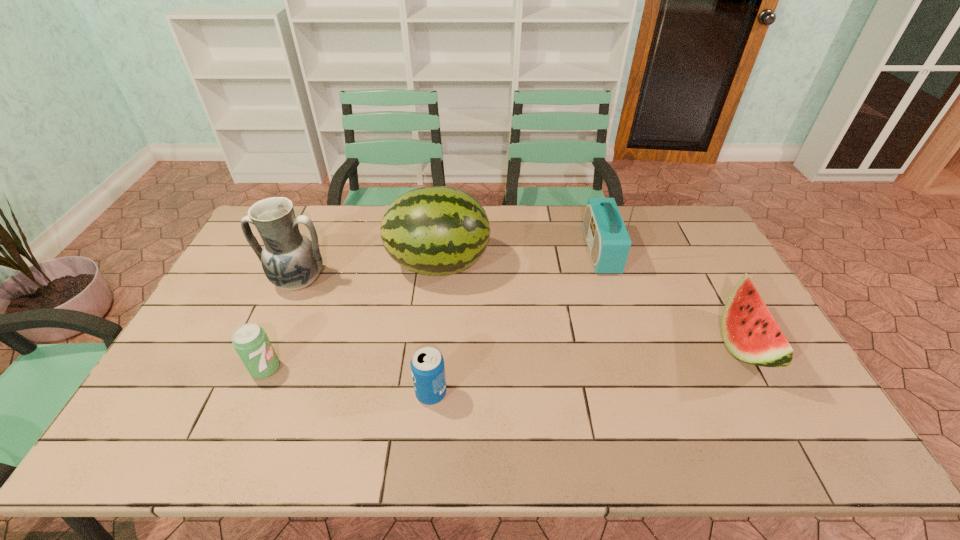
Image resolution: width=960 pixels, height=540 pixels. What are the coordinates of `object that can be found as the closest to the farther watermelon` in the screenshot? It's located at (291, 261).

Locate an element on the screen. This screenshot has height=540, width=960. free location that satisfies the following two spatial constraints: 1. on the front-facing side of the pitcher; 2. on the right side of the right soda is located at coordinates (250, 393).

I want to click on vacant space that satisfies the following two spatial constraints: 1. on the front panel of the fifth object from left to right; 2. on the front-facing side of the pitcher, so pos(610,281).

This screenshot has height=540, width=960. I want to click on vacant area in the image that satisfies the following two spatial constraints: 1. on the front-facing side of the right soda; 2. on the right side of the pitcher, so click(x=250, y=393).

Where is `free spot that satisfies the following two spatial constraints: 1. at the stem end of the taller watermelon; 2. on the right side of the right soda`? The image size is (960, 540). free spot that satisfies the following two spatial constraints: 1. at the stem end of the taller watermelon; 2. on the right side of the right soda is located at coordinates (425, 393).

Identify the location of free location that satisfies the following two spatial constraints: 1. on the back side of the right soda; 2. at the stem end of the farther watermelon. click(x=444, y=264).